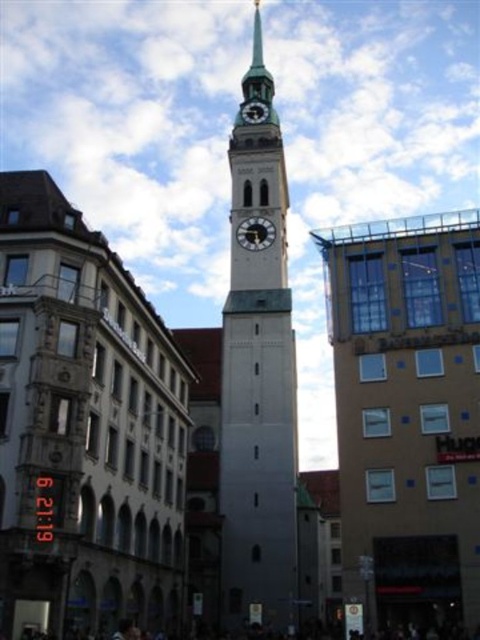
In the scene shown: You are a city planner reviewing the layout of the urban area. You need to ensure that the metallic clock face at center is visible from the main road that runs directly in front of the metallic clock tower at center. Based on their positions, will the clock face be visible to someone standing on the main road?

The metallic clock face at center is below the metallic clock tower at center, so it will be visible to someone standing on the main road as it is positioned lower than the tower itself.

You are an architect analyzing the urban layout of the scene. You notice the metallic clock face at center and the metallic clock tower at center. Which object is located to the left of the other?

The metallic clock face at center is positioned on the left side of the metallic clock tower at center.